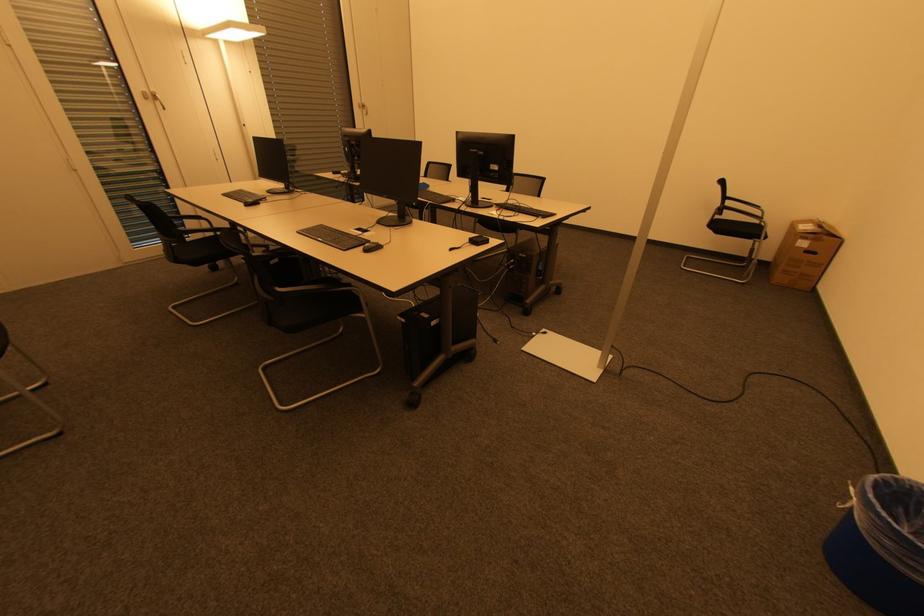
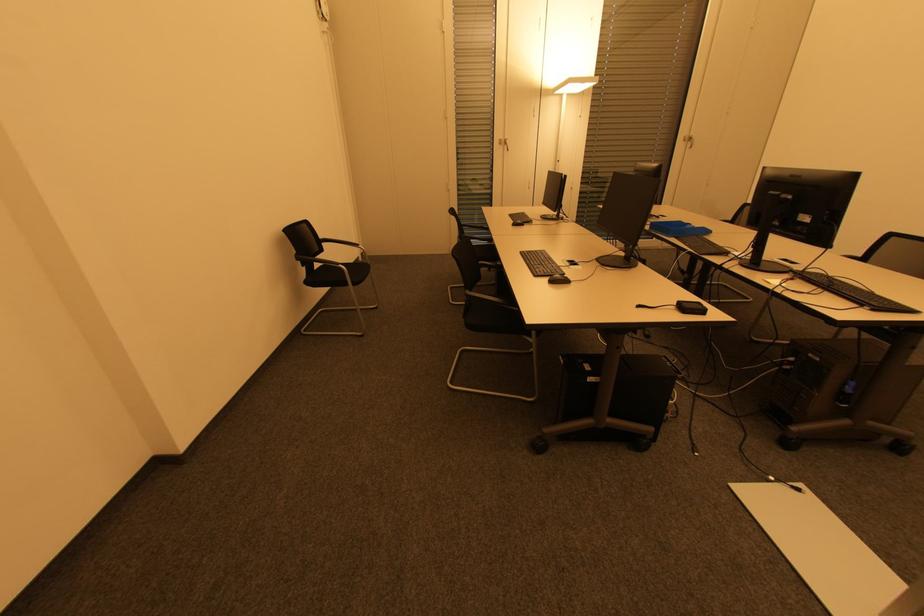
Question: How did the camera likely rotate?

Choices:
 (A) Left
 (B) Right
 (C) Up
 (D) Down

Answer: (A)